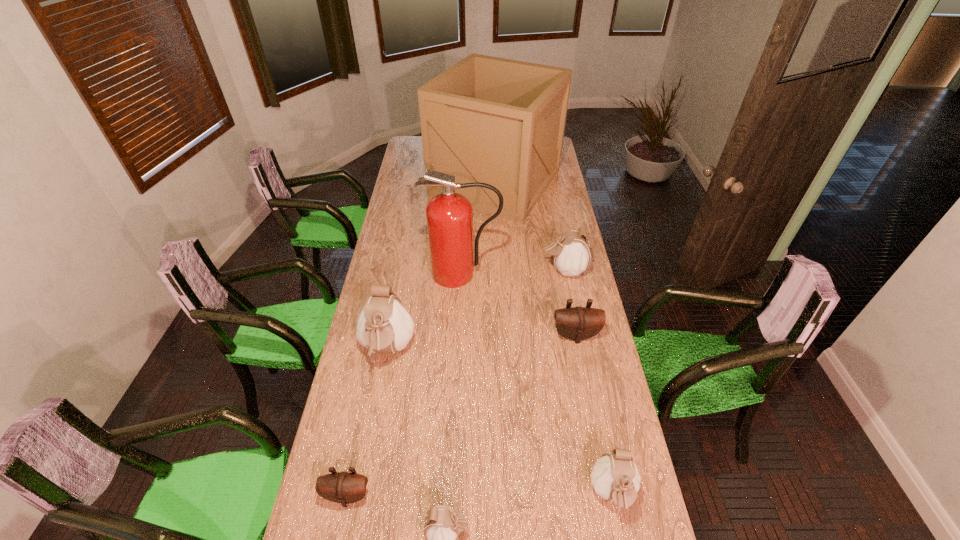
This screenshot has width=960, height=540. I want to click on the left brown pouch, so click(x=343, y=487).

Where is `the smaller brown pouch`? the smaller brown pouch is located at coordinates (343, 487).

Where is `free region located 0.130m on the left of the brown box`? free region located 0.130m on the left of the brown box is located at coordinates (406, 182).

Image resolution: width=960 pixels, height=540 pixels. Identify the location of vacant space situated 0.100m with the handle and nozzle on the fire extinguisher. (461, 306).

The width and height of the screenshot is (960, 540). I want to click on free space located 0.380m on the front-facing side of the sixth shortest object, so click(x=362, y=491).

Where is `vacant space situated 0.180m on the front-facing side of the fifth shortest pouch`? vacant space situated 0.180m on the front-facing side of the fifth shortest pouch is located at coordinates (500, 270).

I want to click on free spot located 0.240m on the front-facing side of the fifth shortest pouch, so click(x=486, y=270).

This screenshot has width=960, height=540. Identify the location of free location located 0.120m on the front-facing side of the fifth shortest pouch. (514, 270).

Find the location of a particular element. Image resolution: width=960 pixels, height=540 pixels. blank space located with the flap open on the farther brown pouch is located at coordinates (582, 365).

I want to click on vacant space located 0.060m with the flap open on the left brown pouch, so tap(340, 532).